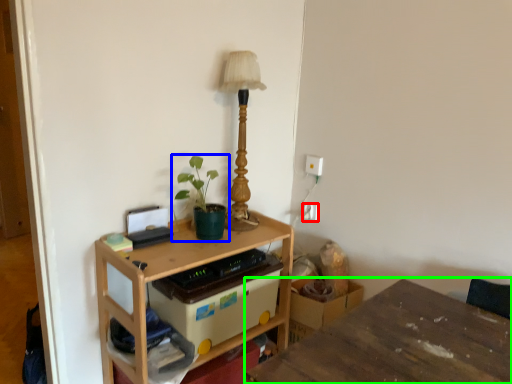
Question: Based on their relative distances, which object is farther from electric outlet (highlighted by a red box)? Choose from houseplant (highlighted by a blue box) and table (highlighted by a green box).

Choices:
 (A) houseplant
 (B) table

Answer: (B)